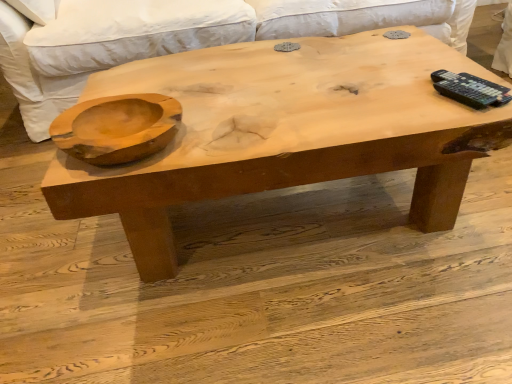
Question: Is natural wood bowl at left in front of or behind white fabric couch at upper center in the image?

Choices:
 (A) front
 (B) behind

Answer: (A)

Question: Looking at their shapes, would you say natural wood bowl at left is wider or thinner than white fabric couch at upper center?

Choices:
 (A) thin
 (B) wide

Answer: (A)

Question: Which is nearer to the natural wood bowl at left?

Choices:
 (A) natural wood coffee table at center
 (B) white fabric couch at upper center

Answer: (A)

Question: Estimate the real-world distances between objects in this image. Which object is farther from the natural wood coffee table at center?

Choices:
 (A) white fabric couch at upper center
 (B) natural wood bowl at left

Answer: (A)